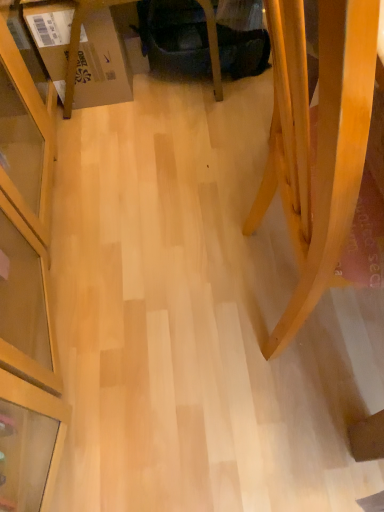
In order to face velvet dark blue swivel chair at center, should I rotate leftwards or rightwards?

It's best to rotate left around 1.571 degrees.

In order to face cardboard box at left, should I rotate leftwards or rightwards?

Rotate left and turn 14.189 degrees.

Identify the location of velvet dark blue swivel chair at center. (198, 42).

Can we say cardboard box at left lies outside velvet dark blue swivel chair at center?

Yes, cardboard box at left is outside of velvet dark blue swivel chair at center.

How much distance is there between cardboard box at left and velvet dark blue swivel chair at center?

cardboard box at left and velvet dark blue swivel chair at center are 10.10 inches apart from each other.

Identify the location of cardboard box located on the left of velvet dark blue swivel chair at center. (81, 51).

Considering the relative sizes of cardboard box at left and velvet dark blue swivel chair at center in the image provided, is cardboard box at left bigger than velvet dark blue swivel chair at center?

Actually, cardboard box at left might be smaller than velvet dark blue swivel chair at center.

Is light wood chair at lower right a part of velvet dark blue swivel chair at center?

No, light wood chair at lower right is not inside velvet dark blue swivel chair at center.

Is velvet dark blue swivel chair at center shorter than light wood chair at lower right?

Yes, velvet dark blue swivel chair at center is shorter than light wood chair at lower right.

Looking at their sizes, would you say velvet dark blue swivel chair at center is wider or thinner than light wood chair at lower right?

Clearly, velvet dark blue swivel chair at center has less width compared to light wood chair at lower right.

Is light wood chair at lower right at the back of velvet dark blue swivel chair at center?

No.

Considering the positions of objects light wood chair at lower right and velvet dark blue swivel chair at center in the image provided, who is in front, light wood chair at lower right or velvet dark blue swivel chair at center?

light wood chair at lower right is in front.

The height and width of the screenshot is (512, 384). I want to click on furniture below the velvet dark blue swivel chair at center (from the image's perspective), so click(x=317, y=142).

Can you confirm if light wood chair at lower right is positioned to the right of velvet dark blue swivel chair at center?

Yes, light wood chair at lower right is to the right of velvet dark blue swivel chair at center.

From the image's perspective, which one is positioned higher, light wood chair at lower right or velvet dark blue swivel chair at center?

velvet dark blue swivel chair at center appears higher in the image.

How far apart are cardboard box at left and light wood chair at lower right?

cardboard box at left and light wood chair at lower right are 32.43 inches apart.

Which is more to the left, cardboard box at left or light wood chair at lower right?

cardboard box at left.

Is cardboard box at left positioned behind light wood chair at lower right?

Yes, cardboard box at left is further from the viewer.

Does cardboard box at left have a greater height compared to light wood chair at lower right?

No, cardboard box at left is not taller than light wood chair at lower right.

Considering the relative positions of light wood chair at lower right and cardboard box at left in the image provided, is light wood chair at lower right to the right of cardboard box at left from the viewer's perspective?

Correct, you'll find light wood chair at lower right to the right of cardboard box at left.

Is light wood chair at lower right positioned beyond the bounds of cardboard box at left?

light wood chair at lower right lies outside cardboard box at left's area.

Is light wood chair at lower right not close to cardboard box at left?

light wood chair at lower right is actually quite close to cardboard box at left.

Between velvet dark blue swivel chair at center and cardboard box at left, which one appears on the right side from the viewer's perspective?

Positioned to the right is velvet dark blue swivel chair at center.

Who is bigger, velvet dark blue swivel chair at center or cardboard box at left?

velvet dark blue swivel chair at center.

Does velvet dark blue swivel chair at center have a greater width compared to cardboard box at left?

Yes.

Locate an element on the screen. This screenshot has width=384, height=512. swivel chair behind the cardboard box at left is located at coordinates coord(198,42).

At what (x,y) coordinates should I click in order to perform the action: click on furniture below the velvet dark blue swivel chair at center (from the image's perspective). Please return your answer as a coordinate pair (x, y). Image resolution: width=384 pixels, height=512 pixels. Looking at the image, I should click on (317, 142).

Looking at the image, which one is located further to velvet dark blue swivel chair at center, light wood chair at lower right or cardboard box at left?

Based on the image, light wood chair at lower right appears to be further to velvet dark blue swivel chair at center.

Which object lies further to the anchor point cardboard box at left, light wood chair at lower right or velvet dark blue swivel chair at center?

Among the two, light wood chair at lower right is located further to cardboard box at left.

Estimate the real-world distances between objects in this image. Which object is closer to light wood chair at lower right, velvet dark blue swivel chair at center or cardboard box at left?

velvet dark blue swivel chair at center lies closer to light wood chair at lower right than the other object.

Looking at this image, estimate the real-world distances between objects in this image. Which object is closer to light wood chair at lower right, cardboard box at left or velvet dark blue swivel chair at center?

velvet dark blue swivel chair at center is positioned closer to the anchor light wood chair at lower right.

Looking at the image, which one is located closer to cardboard box at left, velvet dark blue swivel chair at center or light wood chair at lower right?

velvet dark blue swivel chair at center is closer to cardboard box at left.

Which object lies further to the anchor point velvet dark blue swivel chair at center, cardboard box at left or light wood chair at lower right?

light wood chair at lower right.

Find the location of a particular element. The height and width of the screenshot is (512, 384). cardboard box located between light wood chair at lower right and velvet dark blue swivel chair at center in the depth direction is located at coordinates [x=81, y=51].